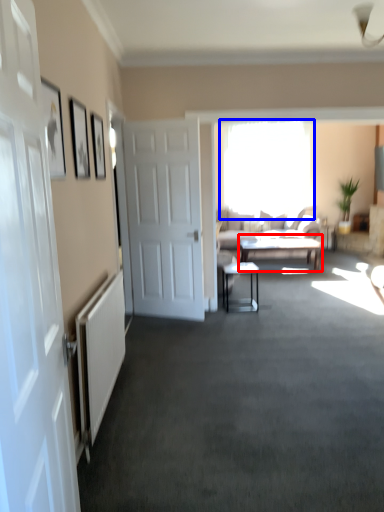
Question: Which object is further to the camera taking this photo, table (highlighted by a red box) or window (highlighted by a blue box)?

Choices:
 (A) table
 (B) window

Answer: (B)